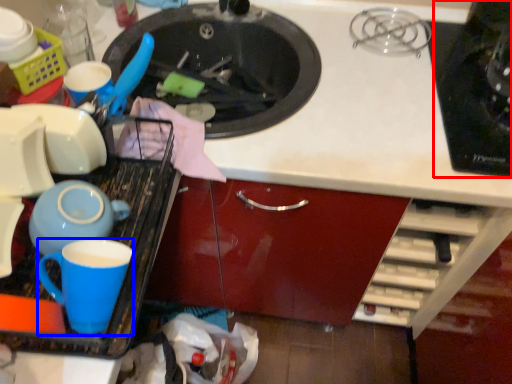
Question: Which object is closer to the camera taking this photo, appliance (highlighted by a red box) or coffee cup (highlighted by a blue box)?

Choices:
 (A) appliance
 (B) coffee cup

Answer: (B)